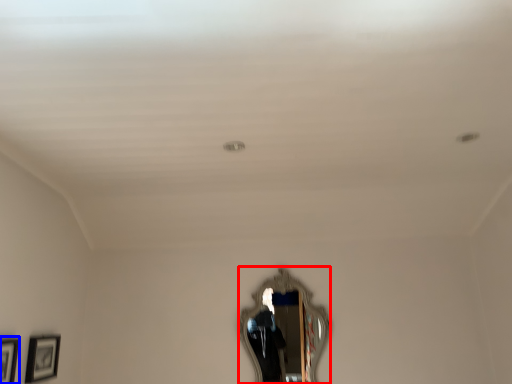
Question: Which of the following is the farthest to the observer, mirror (highlighted by a red box) or picture frame (highlighted by a blue box)?

Choices:
 (A) mirror
 (B) picture frame

Answer: (A)